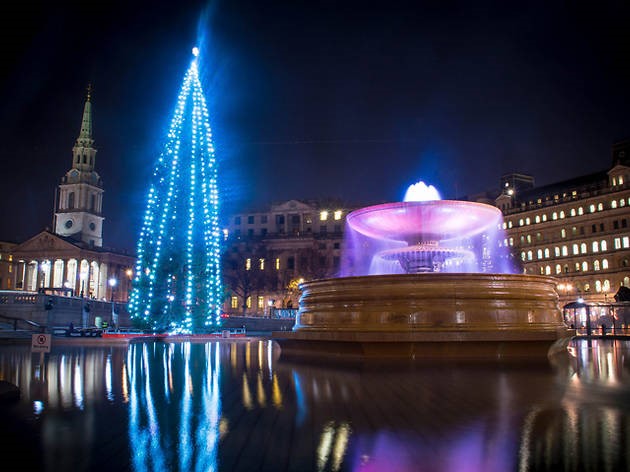
Locate an element on the screen. window is located at coordinates (556, 216), (563, 216).